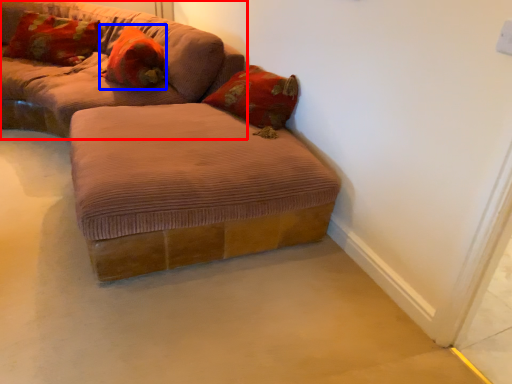
Question: Which of the following is the closest to the observer, studio couch (highlighted by a red box) or pillow (highlighted by a blue box)?

Choices:
 (A) studio couch
 (B) pillow

Answer: (A)